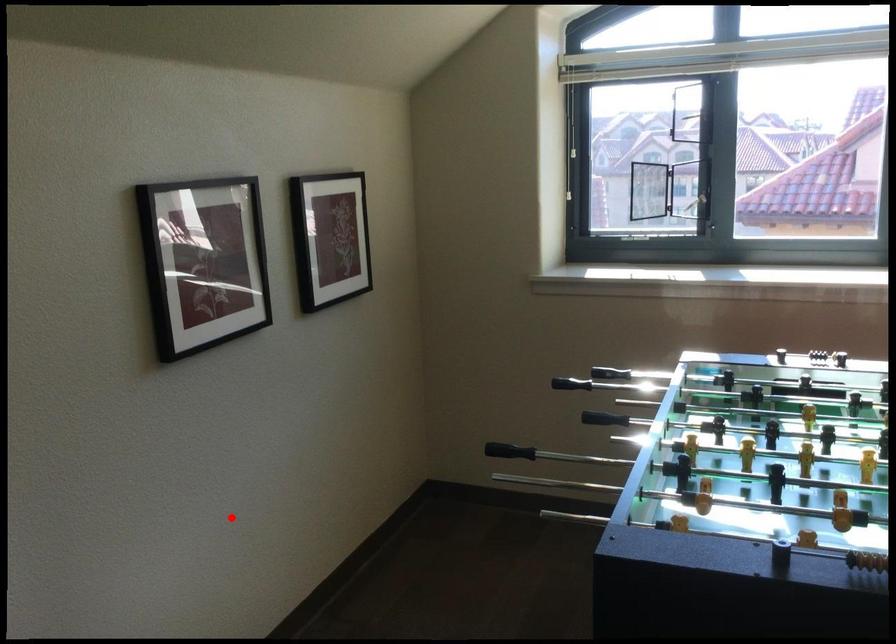
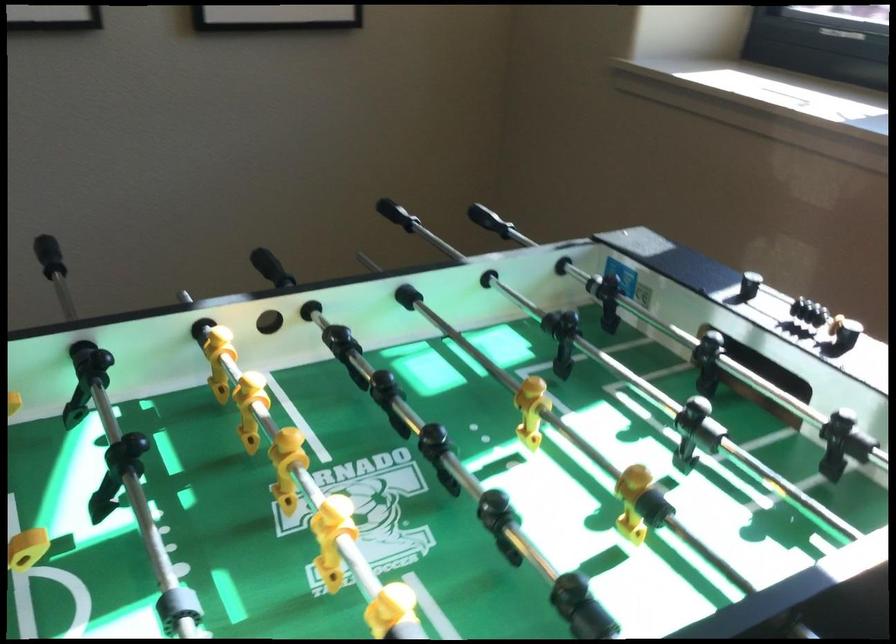
Find the pixel in the second image that matches the highlighted location in the first image.

(48, 256)